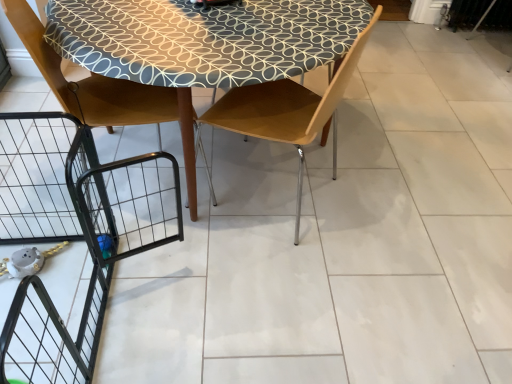
This screenshot has width=512, height=384. I want to click on wooden chair at center, which is counted as the 1th chair, starting from the right, so click(x=289, y=110).

Measure the distance between point (328,118) and camera.

Point (328,118) is 6.15 feet away from camera.

This screenshot has width=512, height=384. Describe the element at coordinates (289, 110) in the screenshot. I see `wooden chair at center, which ranks as the 2th chair in left-to-right order` at that location.

Describe the element at coordinates (92, 83) in the screenshot. I see `matte brown chair at left, the 2th chair in the right-to-left sequence` at that location.

Where is `matte brown chair at left, which ranks as the first chair in left-to-right order`? Image resolution: width=512 pixels, height=384 pixels. matte brown chair at left, which ranks as the first chair in left-to-right order is located at coordinates (92, 83).

Identify the location of wooden chair at center, which is counted as the 1th chair, starting from the right. The image size is (512, 384). (289, 110).

Does wooden chair at center, which is counted as the 1th chair, starting from the right, appear on the left side of matte brown chair at left, the 2th chair in the right-to-left sequence?

No, wooden chair at center, which is counted as the 1th chair, starting from the right, is not to the left of matte brown chair at left, the 2th chair in the right-to-left sequence.

Is wooden chair at center, which ranks as the 2th chair in left-to-right order, positioned before matte brown chair at left, the 2th chair in the right-to-left sequence?

Yes, it is.

Is point (326, 125) closer to camera compared to point (56, 53)?

No, (326, 125) is further to viewer.

From the image's perspective, is wooden chair at center, which is counted as the 1th chair, starting from the right, over matte brown chair at left, which ranks as the first chair in left-to-right order?

Actually, wooden chair at center, which is counted as the 1th chair, starting from the right, appears below matte brown chair at left, which ranks as the first chair in left-to-right order, in the image.

From a real-world perspective, is wooden chair at center, which is counted as the 1th chair, starting from the right, beneath matte brown chair at left, which ranks as the first chair in left-to-right order?

No, from a real-world perspective, wooden chair at center, which is counted as the 1th chair, starting from the right, is not beneath matte brown chair at left, which ranks as the first chair in left-to-right order.

Considering the sizes of objects wooden chair at center, which ranks as the 2th chair in left-to-right order, and matte brown chair at left, which ranks as the first chair in left-to-right order, in the image provided, who is thinner, wooden chair at center, which ranks as the 2th chair in left-to-right order, or matte brown chair at left, which ranks as the first chair in left-to-right order,?

With smaller width is wooden chair at center, which ranks as the 2th chair in left-to-right order.

Is wooden chair at center, which ranks as the 2th chair in left-to-right order, shorter than matte brown chair at left, which ranks as the first chair in left-to-right order?

Indeed, wooden chair at center, which ranks as the 2th chair in left-to-right order, has a lesser height compared to matte brown chair at left, which ranks as the first chair in left-to-right order.

Does wooden chair at center, which is counted as the 1th chair, starting from the right, have a larger size compared to matte brown chair at left, which ranks as the first chair in left-to-right order?

Actually, wooden chair at center, which is counted as the 1th chair, starting from the right, might be smaller than matte brown chair at left, which ranks as the first chair in left-to-right order.

Which is correct: wooden chair at center, which ranks as the 2th chair in left-to-right order, is inside matte brown chair at left, the 2th chair in the right-to-left sequence, or outside of it?

wooden chair at center, which ranks as the 2th chair in left-to-right order, lies outside matte brown chair at left, the 2th chair in the right-to-left sequence.

Are wooden chair at center, which ranks as the 2th chair in left-to-right order, and matte brown chair at left, which ranks as the first chair in left-to-right order, beside each other?

No, wooden chair at center, which ranks as the 2th chair in left-to-right order, is not making contact with matte brown chair at left, which ranks as the first chair in left-to-right order.

Is wooden chair at center, which ranks as the 2th chair in left-to-right order, looking in the opposite direction of matte brown chair at left, which ranks as the first chair in left-to-right order?

No, wooden chair at center, which ranks as the 2th chair in left-to-right order, is not facing the opposite direction of matte brown chair at left, which ranks as the first chair in left-to-right order.

How different are the orientations of wooden chair at center, which ranks as the 2th chair in left-to-right order, and matte brown chair at left, which ranks as the first chair in left-to-right order, in degrees?

131 degrees separate the facing orientations of wooden chair at center, which ranks as the 2th chair in left-to-right order, and matte brown chair at left, which ranks as the first chair in left-to-right order.

Could you measure the distance between wooden chair at center, which is counted as the 1th chair, starting from the right, and matte brown chair at left, which ranks as the first chair in left-to-right order?

They are 37.49 centimeters apart.

This screenshot has height=384, width=512. Identify the location of chair that is on the right side of matte brown chair at left, which ranks as the first chair in left-to-right order. (289, 110).

Considering the positions of objects matte brown chair at left, the 2th chair in the right-to-left sequence, and wooden chair at center, which ranks as the 2th chair in left-to-right order, in the image provided, who is more to the right, matte brown chair at left, the 2th chair in the right-to-left sequence, or wooden chair at center, which ranks as the 2th chair in left-to-right order,?

From the viewer's perspective, wooden chair at center, which ranks as the 2th chair in left-to-right order, appears more on the right side.

Is matte brown chair at left, the 2th chair in the right-to-left sequence, closer to camera compared to wooden chair at center, which ranks as the 2th chair in left-to-right order?

No, matte brown chair at left, the 2th chair in the right-to-left sequence, is further to the viewer.

Does point (91, 118) appear closer or farther from the camera than point (311, 140)?

Point (91, 118) appears to be farther away from the viewer than point (311, 140).

From the image's perspective, which is below, matte brown chair at left, the 2th chair in the right-to-left sequence, or wooden chair at center, which ranks as the 2th chair in left-to-right order?

wooden chair at center, which ranks as the 2th chair in left-to-right order, appears lower in the image.

From a real-world perspective, is matte brown chair at left, the 2th chair in the right-to-left sequence, beneath wooden chair at center, which is counted as the 1th chair, starting from the right?

Yes, from a real-world perspective, matte brown chair at left, the 2th chair in the right-to-left sequence, is beneath wooden chair at center, which is counted as the 1th chair, starting from the right.

Is matte brown chair at left, which ranks as the first chair in left-to-right order, thinner than wooden chair at center, which is counted as the 1th chair, starting from the right?

No.

Which of these two, matte brown chair at left, which ranks as the first chair in left-to-right order, or wooden chair at center, which is counted as the 1th chair, starting from the right, stands shorter?

With less height is wooden chair at center, which is counted as the 1th chair, starting from the right.

Can you confirm if matte brown chair at left, which ranks as the first chair in left-to-right order, is smaller than wooden chair at center, which is counted as the 1th chair, starting from the right?

Incorrect, matte brown chair at left, which ranks as the first chair in left-to-right order, is not smaller in size than wooden chair at center, which is counted as the 1th chair, starting from the right.

Would you say matte brown chair at left, which ranks as the first chair in left-to-right order, contains wooden chair at center, which ranks as the 2th chair in left-to-right order?

No.

Is matte brown chair at left, the 2th chair in the right-to-left sequence, with wooden chair at center, which is counted as the 1th chair, starting from the right?

No, matte brown chair at left, the 2th chair in the right-to-left sequence, is not beside wooden chair at center, which is counted as the 1th chair, starting from the right.

Is matte brown chair at left, which ranks as the first chair in left-to-right order, facing towards wooden chair at center, which is counted as the 1th chair, starting from the right?

Yes, matte brown chair at left, which ranks as the first chair in left-to-right order, faces towards wooden chair at center, which is counted as the 1th chair, starting from the right.

The height and width of the screenshot is (384, 512). I want to click on chair that appears on the left of wooden chair at center, which ranks as the 2th chair in left-to-right order, so click(x=92, y=83).

Find the location of a particular element. chair on the right of matte brown chair at left, which ranks as the first chair in left-to-right order is located at coordinates (289, 110).

Find the location of a particular element. chair beneath the wooden chair at center, which ranks as the 2th chair in left-to-right order (from a real-world perspective) is located at coordinates point(92,83).